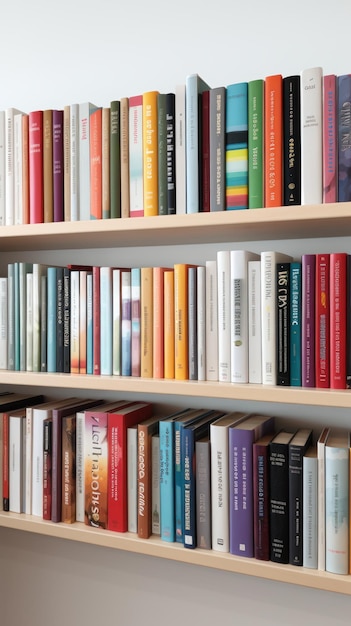
What are the coordinates of `books with white spines on middle shelf` in the screenshot? It's located at (268, 316), (255, 312), (238, 308), (224, 307), (210, 307), (202, 302), (37, 305), (30, 308), (3, 307), (75, 312).